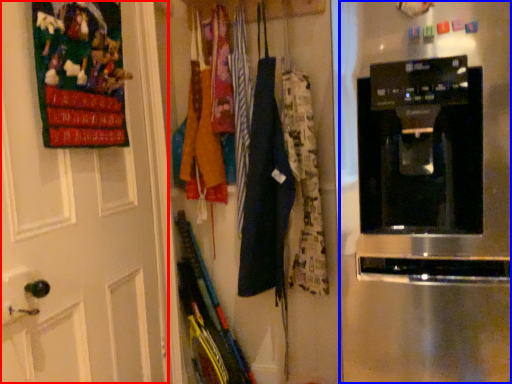
Question: Which object appears closest to the camera in this image, door (highlighted by a red box) or home appliance (highlighted by a blue box)?

Choices:
 (A) door
 (B) home appliance

Answer: (B)